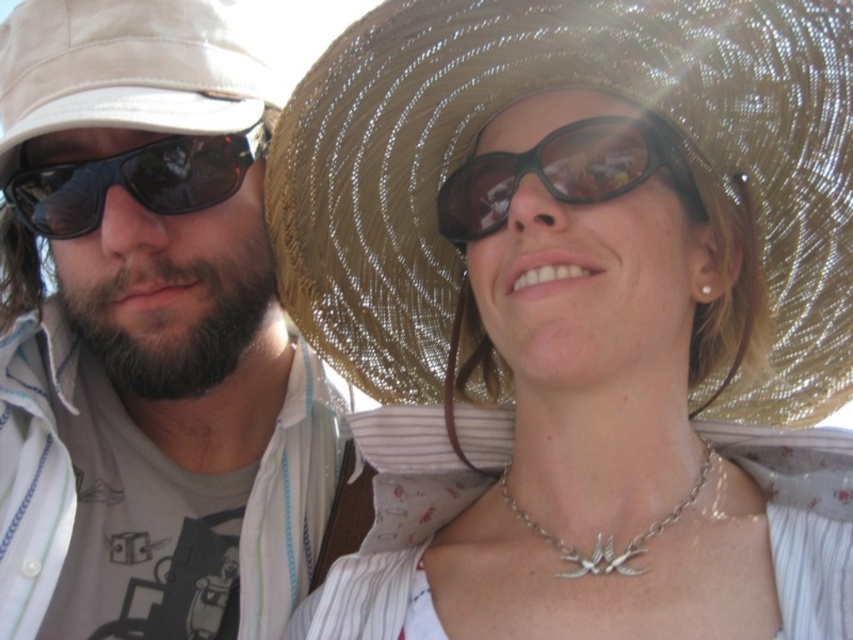
You are a photographer trying to capture a closeup of the silver metallic necklace at center. However, the matte black sunglasses at left are blocking your view. Can you determine if the sunglasses are closer to you than the necklace?

The matte black sunglasses at left is further to the viewer than silver metallic necklace at center, so the sunglasses are closer to you and blocking the necklace.

You are a photographer trying to capture both the woven straw hat at upper center and the beige fabric cowboy hat at left in a single shot. Based on their positions, which hat should you focus on first to ensure both are in frame?

The woven straw hat at upper center is located below the beige fabric cowboy hat at left, so you should focus on the beige fabric cowboy hat at left first to ensure both are in frame.